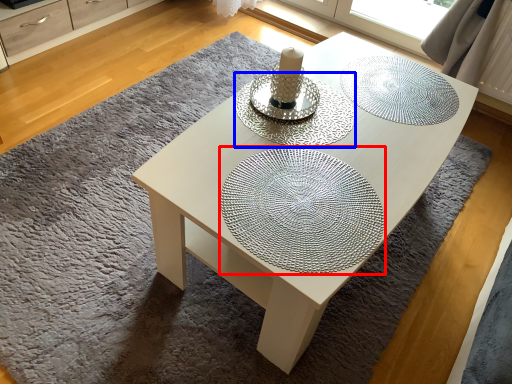
Question: Which point is further to the camera, glass plate (highlighted by a red box) or glass plate (highlighted by a blue box)?

Choices:
 (A) glass plate
 (B) glass plate

Answer: (B)